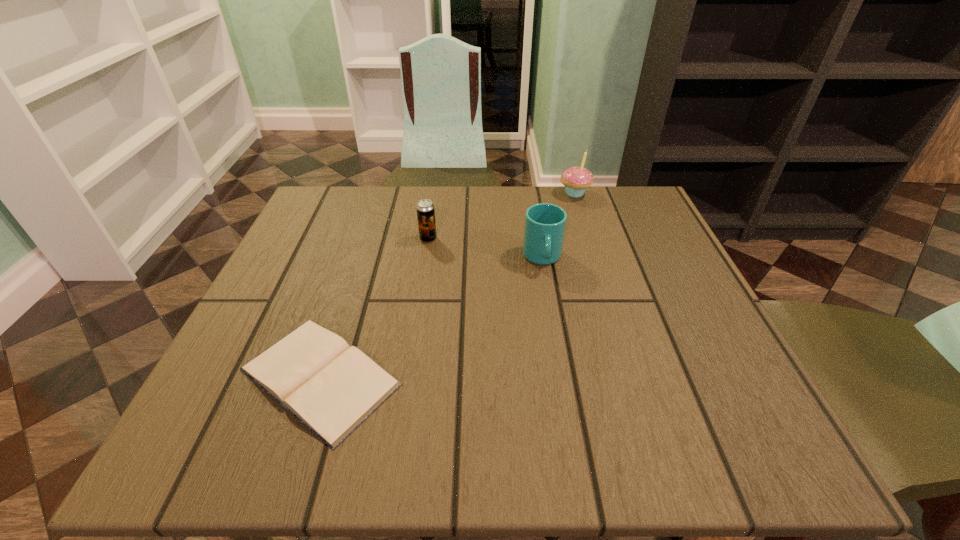
This screenshot has width=960, height=540. I want to click on vacant space at the left edge of the desktop, so click(x=309, y=271).

Locate an element on the screen. The image size is (960, 540). vacant space at the right edge is located at coordinates (688, 276).

The width and height of the screenshot is (960, 540). In the image, there is a desktop. What are the coordinates of `blank space at the far left corner` in the screenshot? It's located at (349, 221).

Where is `blank space at the near left corner of the desktop`? The width and height of the screenshot is (960, 540). blank space at the near left corner of the desktop is located at coordinates (248, 410).

Find the location of a particular element. This screenshot has width=960, height=540. vacant space at the far right corner of the desktop is located at coordinates (633, 199).

You are a GUI agent. You are given a task and a screenshot of the screen. Output one action in this format:
    pyautogui.click(x=<x>, y=<y>)
    Task: Click on the free spot at the near right corner of the desktop
    Image resolution: width=960 pixels, height=540 pixels.
    Given the screenshot: What is the action you would take?
    pyautogui.click(x=739, y=457)

At what (x,y) coordinates should I click in order to perform the action: click on vacant region between the second object from right to left and the nearest object. Please return your answer as a coordinate pair (x, y). The height and width of the screenshot is (540, 960). Looking at the image, I should click on (431, 317).

I want to click on free space between the rightmost object and the beer can, so click(501, 216).

The height and width of the screenshot is (540, 960). What are the coordinates of `free spot between the beer can and the second object from right to left` in the screenshot? It's located at (486, 248).

This screenshot has height=540, width=960. Identify the location of blank region between the beer can and the nearest object. (374, 307).